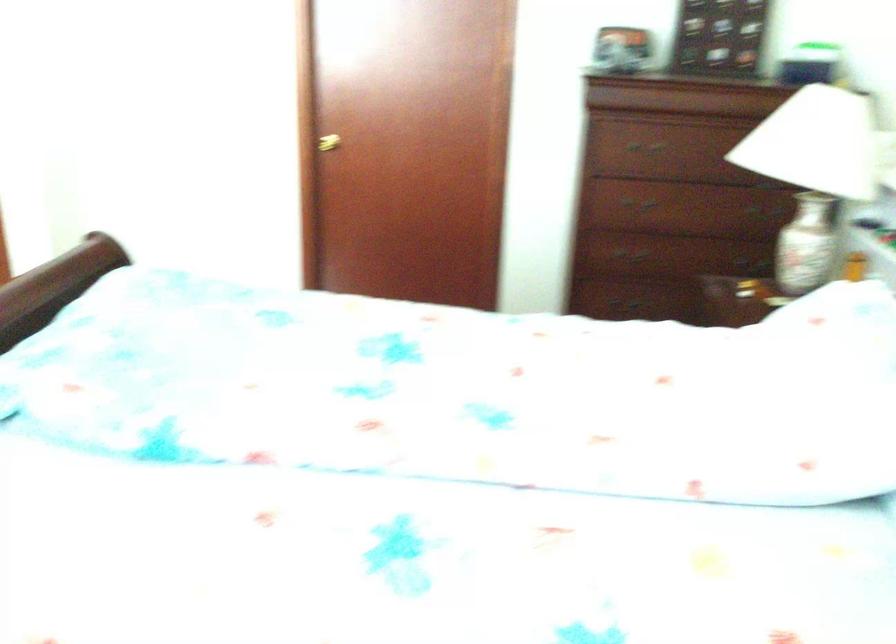
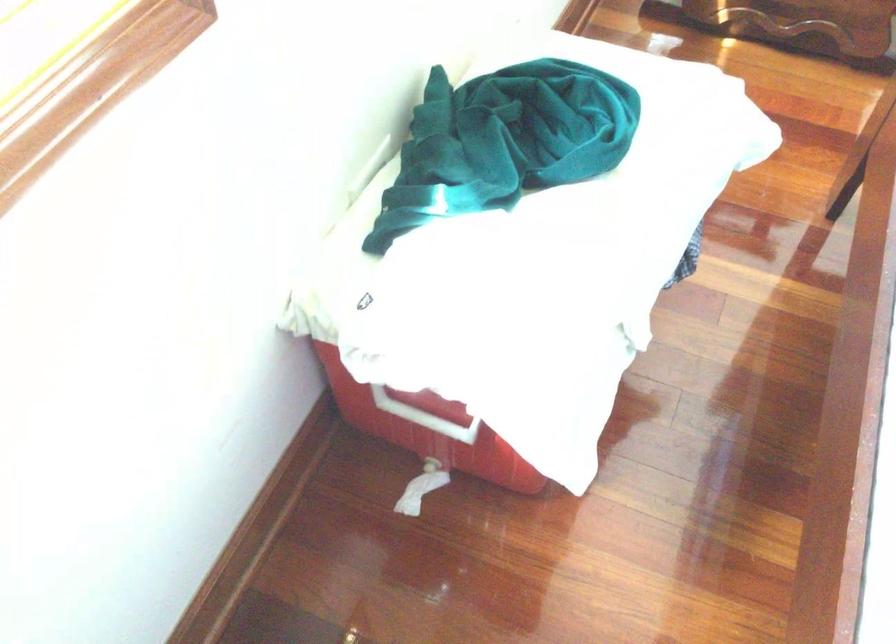
How did the camera likely rotate?

The camera's rotation is toward left-down.